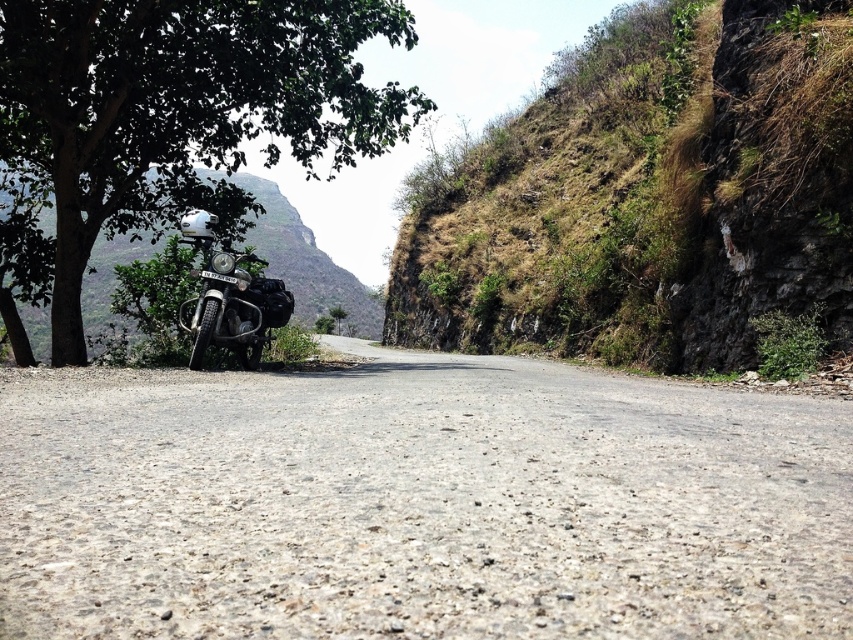
Question: Does dull brown rock at upper right appear over green grassy mountain at left?

Choices:
 (A) yes
 (B) no

Answer: (A)

Question: Which object is positioned closest to the shiny chrome motorcycle at center?

Choices:
 (A) gray asphalt road at center
 (B) green grassy mountain at left
 (C) green leafy tree at left
 (D) dull brown rock at upper right

Answer: (A)

Question: Is dull brown rock at upper right above shiny chrome motorcycle at center?

Choices:
 (A) yes
 (B) no

Answer: (A)

Question: Does gray asphalt road at center have a lesser width compared to shiny chrome motorcycle at center?

Choices:
 (A) no
 (B) yes

Answer: (A)

Question: Which object appears closest to the camera in this image?

Choices:
 (A) dull brown rock at upper right
 (B) green leafy tree at left

Answer: (B)

Question: Which point appears farthest from the camera in this image?

Choices:
 (A) (276, 205)
 (B) (846, 531)
 (C) (659, 326)
 (D) (187, 330)

Answer: (A)